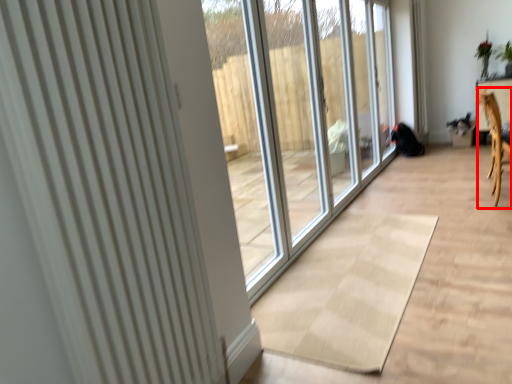
Question: Where is armchair (annotated by the red box) located in relation to radiator in the image?

Choices:
 (A) left
 (B) right

Answer: (B)